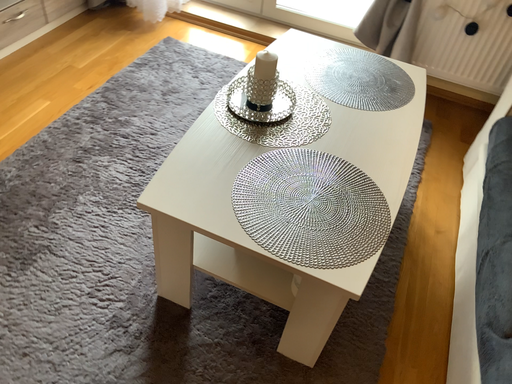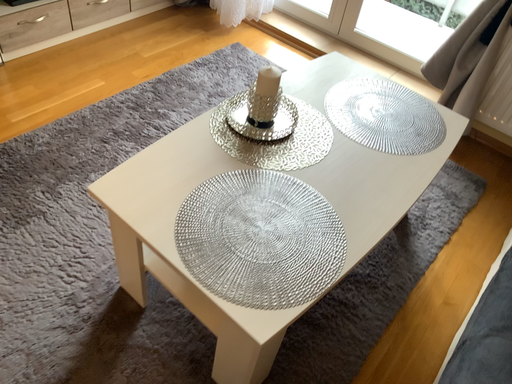
Question: How did the camera likely rotate when shooting the video?

Choices:
 (A) rotated right
 (B) rotated left

Answer: (B)